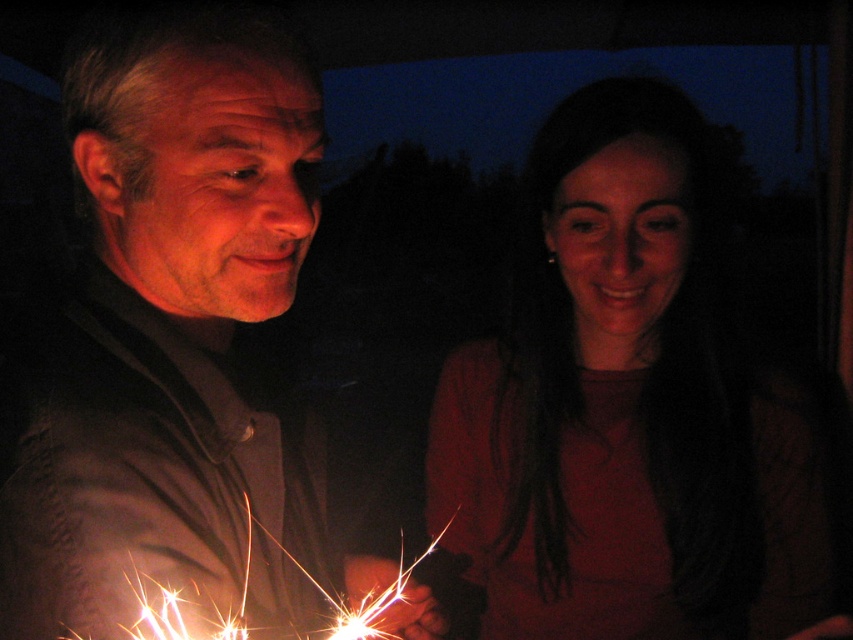
You are standing in the scene and want to find the matte black shirt at left. According to the coordinates provided, where should you look relative to the center of the image?

The matte black shirt at left is located at coordinates point (183, 342), which is slightly to the right and just below the center of the image.

You are a photographer taking a picture of the two people in the scene. You notice the matte black shirt at left and the matte red shirt at center. Which shirt should you focus on first if you want to capture the one that is higher in the frame?

The matte black shirt at left is above the matte red shirt at center, so you should focus on the matte black shirt at left first.